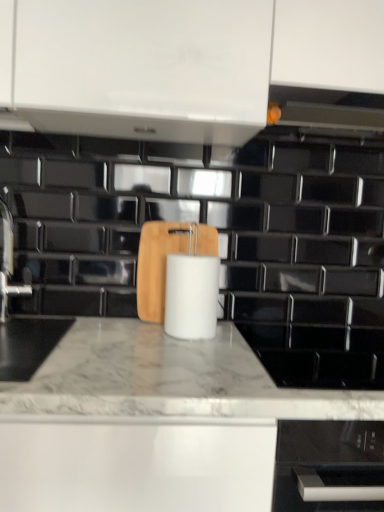
I want to click on vacant space to the right of white matte paper towel at center, so click(x=243, y=343).